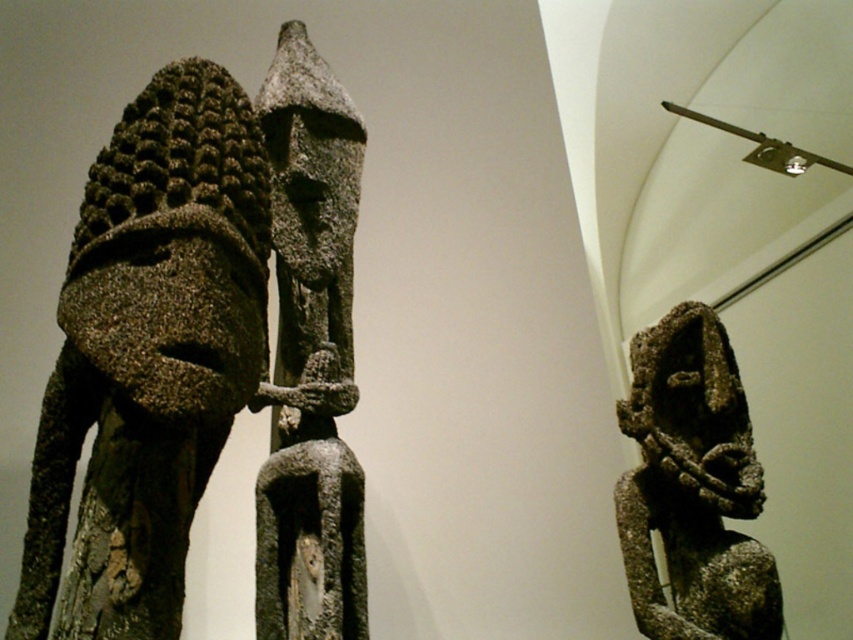
Question: Is rough stone statue at center positioned in front of rusty stone figure at center?

Choices:
 (A) yes
 (B) no

Answer: (A)

Question: Which point is farther to the camera?

Choices:
 (A) (97, 349)
 (B) (320, 419)
 (C) (712, 584)

Answer: (C)

Question: Which of the following is the farthest from the observer?

Choices:
 (A) rough stone mask at center
 (B) rough stone statue at center

Answer: (A)

Question: Considering the relative positions of rough stone mask at center and rough stone statue at center in the image provided, where is rough stone mask at center located with respect to rough stone statue at center?

Choices:
 (A) left
 (B) right

Answer: (B)

Question: Is rough stone statue at center positioned in front of rusty stone figure at center?

Choices:
 (A) no
 (B) yes

Answer: (B)

Question: Which is nearer to the rough stone statue at center?

Choices:
 (A) rough stone mask at center
 (B) rusty stone figure at center

Answer: (A)